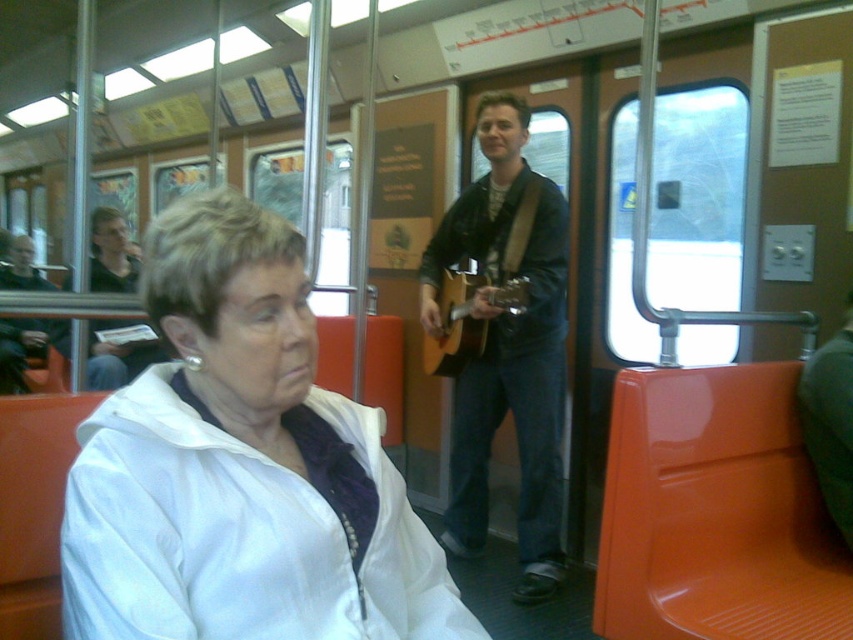
You are a passenger on the train and you want to place both the matte brown guitar at center and the acoustic wood guitar at center vertically against the wall. Which guitar would require more vertical space?

The matte brown guitar at center requires more vertical space because it is much taller than the acoustic wood guitar at center.

You are a passenger on a train and you see the white matte jacket at center and the acoustic wood guitar at center. Which object is taller?

The white matte jacket at center is taller than the acoustic wood guitar at center.

You are a passenger on a train and you want to know if the white matte jacket at center can fit into the overhead compartment which is as wide as the matte brown guitar at center. Can it fit?

The white matte jacket at center is wider than the matte brown guitar at center. Since the overhead compartment is as wide as the guitar, the jacket will not fit.